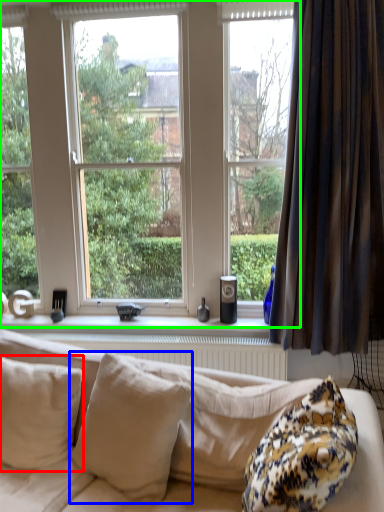
Question: Which is farther away from pillow (highlighted by a red box)? pillow (highlighted by a blue box) or window (highlighted by a green box)?

Choices:
 (A) pillow
 (B) window

Answer: (B)